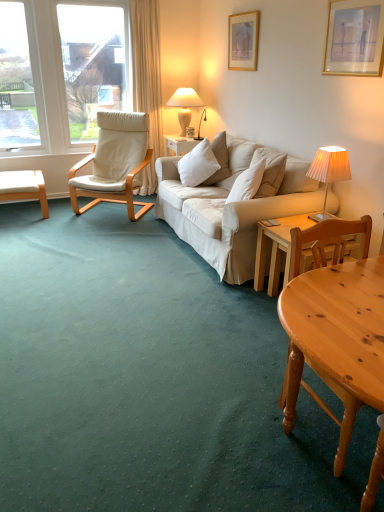
Question: Does point (200, 159) appear closer or farther from the camera than point (185, 124)?

Choices:
 (A) closer
 (B) farther

Answer: (A)

Question: Is white soft cushion at center wider or thinner than white glossy lamp at upper center, marked as the 1th lamp in a left-to-right arrangement?

Choices:
 (A) wide
 (B) thin

Answer: (A)

Question: Which object is positioned farthest from the pleated fabric lampshade at right, positioned as the first lamp in right-to-left order?

Choices:
 (A) light wood desk at lower right, which ranks as the 1th desk in bottom-to-top order
 (B) light brown wooden table at lower right
 (C) wooden picture frame at upper center, positioned as the second picture frame in right-to-left order
 (D) white glossy lamp at upper center, placed as the first lamp when sorted from top to bottom
 (E) white leather chair at left, placed as the 1th desk when sorted from back to front

Answer: (E)

Question: Considering the real-world distances, which object is farthest from the light wood desk at lower right, which ranks as the 1th desk in bottom-to-top order?

Choices:
 (A) white leather chair at left
 (B) wooden picture frame at upper center, positioned as the first picture frame in left-to-right order
 (C) light brown wooden table at lower right
 (D) white glossy lamp at upper center, placed as the first lamp when sorted from top to bottom
 (E) pleated fabric lampshade at right, positioned as the first lamp in right-to-left order

Answer: (D)